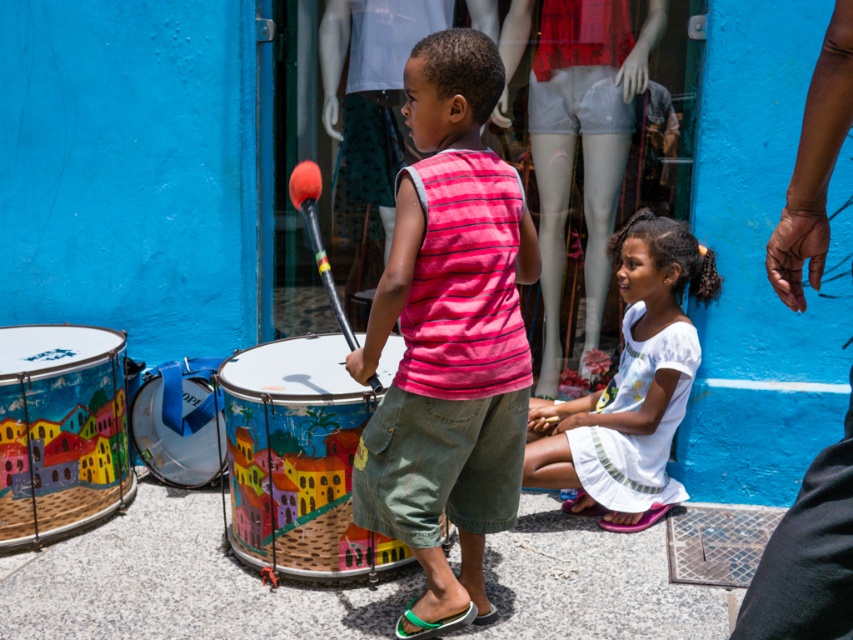
Question: Which object is positioned closest to the painted wooden drum at lower left?

Choices:
 (A) white cotton dress at lower center
 (B) pink striped sleeveless shirt at center
 (C) metallic blue drum at lower left

Answer: (C)

Question: Considering the relative positions of pink striped sleeveless shirt at center and metallic blue drum at lower left in the image provided, where is pink striped sleeveless shirt at center located with respect to metallic blue drum at lower left?

Choices:
 (A) right
 (B) left

Answer: (A)

Question: Does white cotton dress at lower center appear on the right side of painted wooden drum at lower left?

Choices:
 (A) yes
 (B) no

Answer: (A)

Question: Which point is closer to the camera?

Choices:
 (A) smooth concrete pavement at center
 (B) pink striped sleeveless shirt at center
 (C) white cotton dress at lower center
 (D) metallic blue drum at lower left

Answer: (B)

Question: Among these points, which one is farthest from the camera?

Choices:
 (A) (273, 369)
 (B) (712, 278)

Answer: (B)

Question: Is white cotton dress at lower center below metallic blue drum at lower left?

Choices:
 (A) no
 (B) yes

Answer: (A)